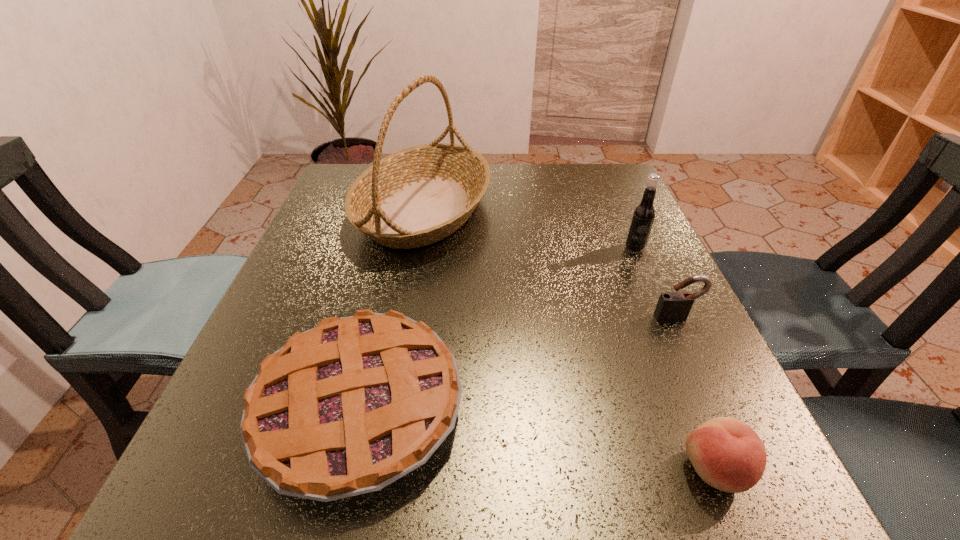
This screenshot has width=960, height=540. Identify the location of object positioned at the near left corner. (346, 408).

This screenshot has width=960, height=540. What are the coordinates of `object present at the near right corner` in the screenshot? It's located at (727, 454).

The width and height of the screenshot is (960, 540). I want to click on free space at the far edge of the desktop, so (x=533, y=183).

Find the location of a particular element. vacant space at the near edge of the desktop is located at coordinates (540, 460).

I want to click on vacant space at the left edge, so click(x=345, y=274).

In the image, there is a desktop. Identify the location of free region at the right edge. (605, 282).

This screenshot has width=960, height=540. In order to click on free location at the near left corner in this screenshot , I will do `click(206, 476)`.

In the image, there is a desktop. Where is `free region at the far right corner`? free region at the far right corner is located at coordinates (612, 202).

The height and width of the screenshot is (540, 960). What are the coordinates of `blank space at the near right corner` in the screenshot? It's located at (651, 491).

Where is `vacant area that lies between the peach and the shortest object`? This screenshot has width=960, height=540. vacant area that lies between the peach and the shortest object is located at coordinates (538, 438).